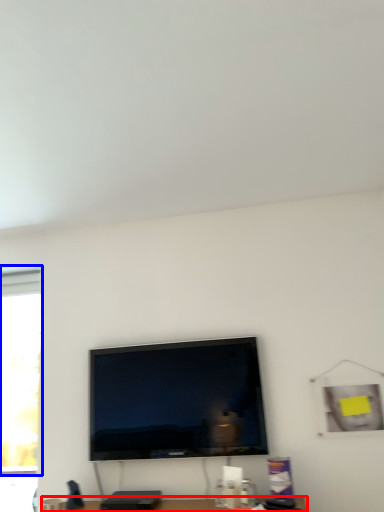
Question: Which point is further to the camera, furniture (highlighted by a red box) or window (highlighted by a blue box)?

Choices:
 (A) furniture
 (B) window

Answer: (B)